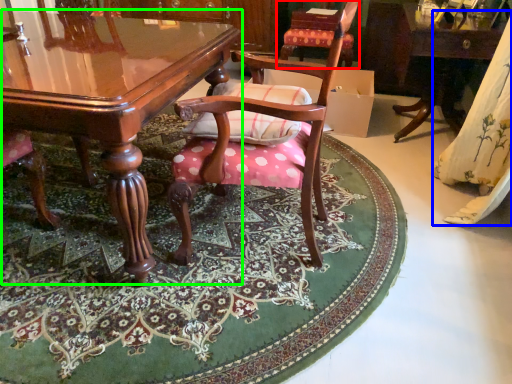
Question: Based on their relative distances, which object is farther from chair (highlighted by a red box)? Choose from curtain (highlighted by a blue box) and table (highlighted by a green box).

Choices:
 (A) curtain
 (B) table

Answer: (B)